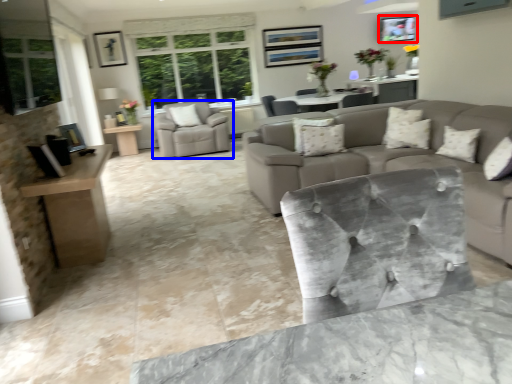
Question: Which of the following is the closest to the observer, picture frame (highlighted by a red box) or chair (highlighted by a blue box)?

Choices:
 (A) picture frame
 (B) chair

Answer: (B)